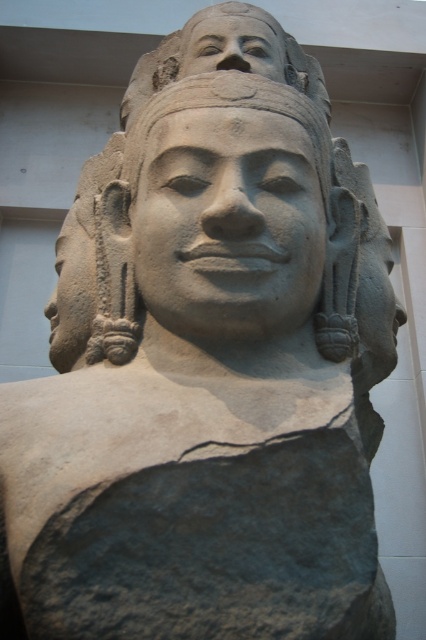
Question: Which point appears closest to the camera in this image?

Choices:
 (A) (100, 339)
 (B) (244, 292)
 (C) (261, 12)

Answer: (B)

Question: Is matte stone ear at left smaller than smooth stone face at upper center?

Choices:
 (A) yes
 (B) no

Answer: (B)

Question: Can you confirm if gray stone face at center is smaller than smooth stone face at upper center?

Choices:
 (A) no
 (B) yes

Answer: (A)

Question: Which object is farther from the camera taking this photo?

Choices:
 (A) gray stone face at center
 (B) matte stone ear at left

Answer: (B)

Question: Among these points, which one is nearest to the camera?

Choices:
 (A) (227, 12)
 (B) (94, 212)

Answer: (B)

Question: Does gray stone face at center have a greater width compared to matte stone ear at left?

Choices:
 (A) no
 (B) yes

Answer: (B)